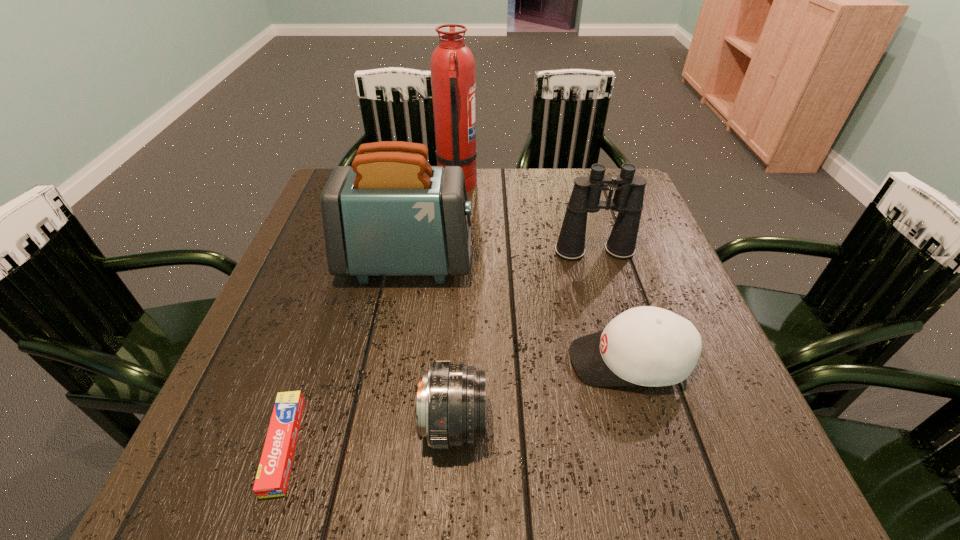
Locate an element on the screen. free area in between the fifth shortest object and the binoculars is located at coordinates (500, 257).

At what (x,y) coordinates should I click in order to perform the action: click on free space that is in between the fire extinguisher and the shortest object. Please return your answer as a coordinate pair (x, y). This screenshot has height=540, width=960. Looking at the image, I should click on (371, 315).

This screenshot has width=960, height=540. In order to click on free space between the telephoto lens and the toaster in this screenshot , I will do `click(430, 343)`.

Locate an element on the screen. vacant space that is in between the binoculars and the fire extinguisher is located at coordinates click(x=526, y=219).

Find the location of a particular element. This screenshot has width=960, height=540. free spot between the telephoto lens and the third tallest object is located at coordinates (524, 338).

Where is `empty location between the toothpaste and the fire extinguisher`? empty location between the toothpaste and the fire extinguisher is located at coordinates (371, 315).

This screenshot has width=960, height=540. I want to click on free space between the telephoto lens and the baseball cap, so click(541, 393).

Choose which object is the fourth nearest neighbor to the toothpaste. Please provide its 2D coordinates. Your answer should be formatted as a tuple, i.e. [(x, y)], where the tuple contains the x and y coordinates of a point satisfying the conditions above.

[(628, 198)]

Locate an element on the screen. The image size is (960, 540). object that is the fourth nearest to the shortest object is located at coordinates (628, 198).

At what (x,y) coordinates should I click in order to perform the action: click on free region that satisfies the following two spatial constraints: 1. on the label side of the fire extinguisher; 2. on the right side of the binoculars. Please return your answer as a coordinate pair (x, y). Looking at the image, I should click on (452, 252).